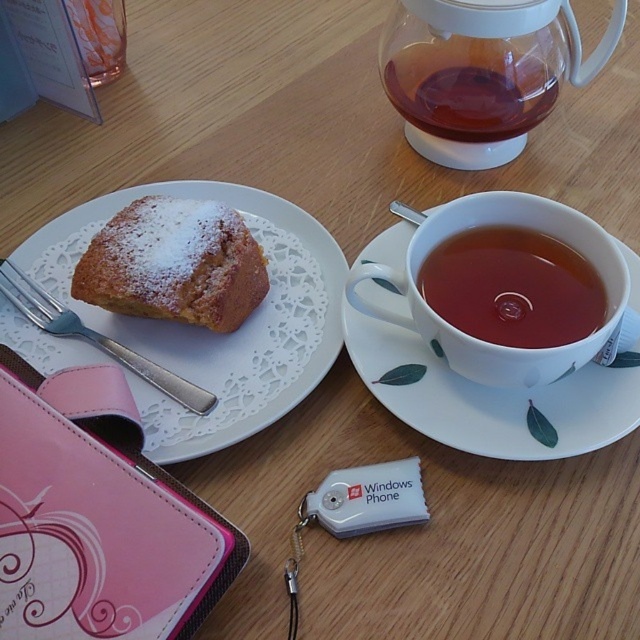
Question: Is transparent glass teapot at upper right closer to camera compared to pink leather wallet at lower left?

Choices:
 (A) no
 (B) yes

Answer: (A)

Question: Is transparent glass teapot at upper right behind powdered golden cake at upper left?

Choices:
 (A) no
 (B) yes

Answer: (B)

Question: Which object is closer to the camera taking this photo?

Choices:
 (A) transparent glass teapot at upper right
 (B) powdered golden cake at upper left
 (C) brown matte cup at upper center
 (D) pink leather wallet at lower left

Answer: (D)

Question: Is the position of transparent glass teapot at upper right more distant than that of white ceramic saucer at upper right?

Choices:
 (A) yes
 (B) no

Answer: (A)

Question: Which of the following is the farthest from the observer?

Choices:
 (A) white ceramic saucer at upper right
 (B) powdered sugar cake at left
 (C) translucent glass teapot at upper center
 (D) transparent glass teapot at upper right

Answer: (C)

Question: Among these points, which one is farthest from the camera?

Choices:
 (A) (228, 403)
 (B) (413, 60)
 (C) (634, 426)

Answer: (B)